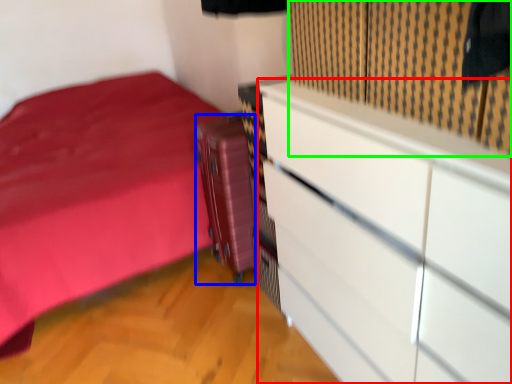
Question: Which object is positioned closest to chest of drawers (highlighted by a red box)? Select from luggage (highlighted by a blue box) and curtain (highlighted by a green box).

Choices:
 (A) luggage
 (B) curtain

Answer: (B)